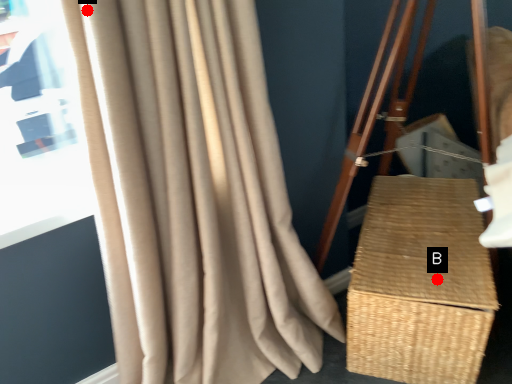
Question: Two points are circled on the image, labeled by A and B beside each circle. Among these points, which one is farthest from the camera?

Choices:
 (A) A is further
 (B) B is further

Answer: (B)